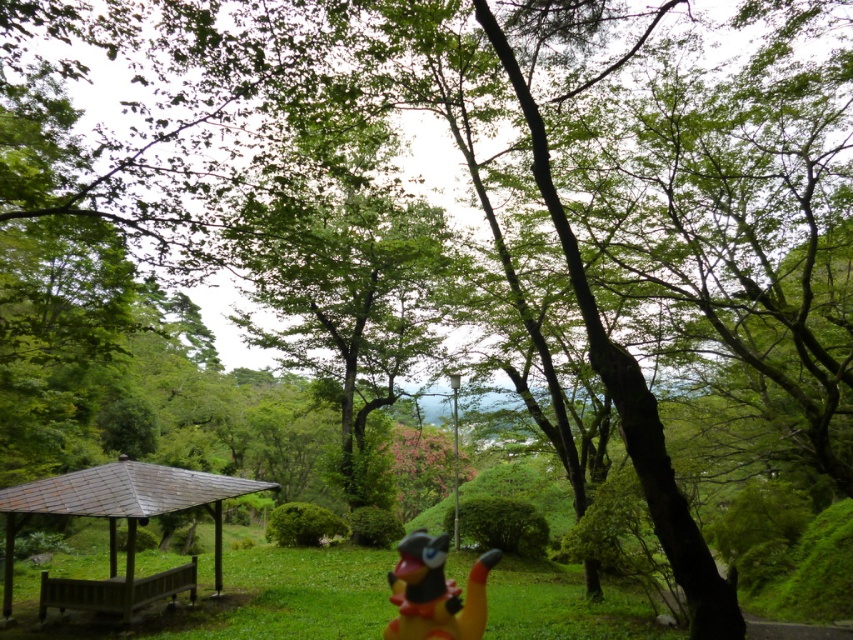
Question: From the image, what is the correct spatial relationship of brown wooden gazebo at lower left in relation to rubber yellow toy at center?

Choices:
 (A) right
 (B) left

Answer: (B)

Question: Which of the following is the farthest from the observer?

Choices:
 (A) (212, 488)
 (B) (430, 634)

Answer: (A)

Question: Which point is closer to the camera?

Choices:
 (A) (412, 568)
 (B) (70, 508)

Answer: (A)

Question: Can you confirm if brown wooden gazebo at lower left is thinner than rubber yellow toy at center?

Choices:
 (A) yes
 (B) no

Answer: (A)

Question: Is brown wooden gazebo at lower left smaller than rubber yellow toy at center?

Choices:
 (A) yes
 (B) no

Answer: (A)